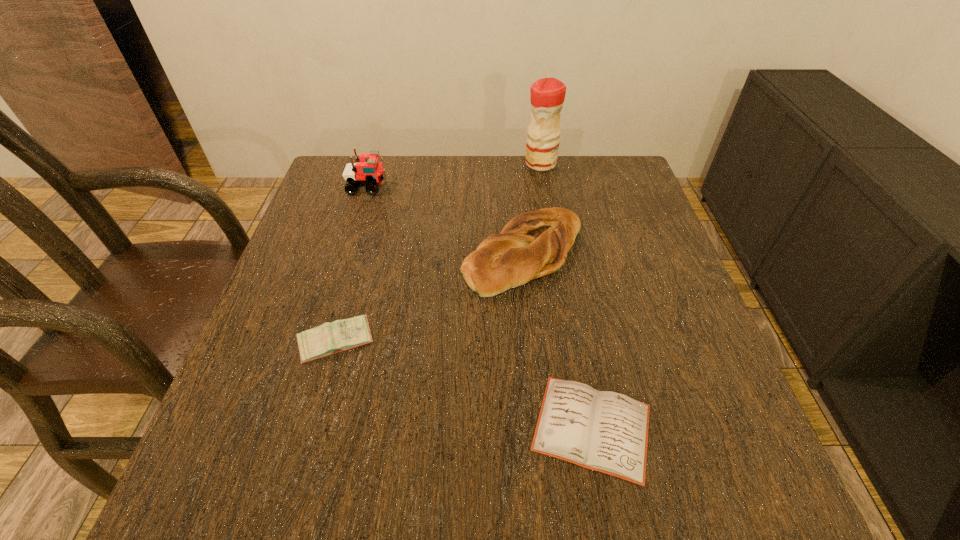
You are a GUI agent. You are given a task and a screenshot of the screen. Output one action in this format:
    pyautogui.click(x=<x>, y=<y>)
    Task: Click on the object positioned at the right edge
    The image size is (960, 540).
    Given the screenshot: What is the action you would take?
    pyautogui.click(x=604, y=431)

In order to click on object that is at the far left corner in this screenshot , I will do (x=368, y=172).

Where is `object at the near right corner`? This screenshot has height=540, width=960. object at the near right corner is located at coordinates (604, 431).

You are a GUI agent. You are given a task and a screenshot of the screen. Output one action in this format:
    pyautogui.click(x=<x>, y=<y>)
    Task: Click on the vacant space at the far edge
    The height and width of the screenshot is (540, 960).
    Given the screenshot: What is the action you would take?
    pyautogui.click(x=452, y=174)

The image size is (960, 540). What are the coordinates of `free region at the near edge` in the screenshot? It's located at (377, 490).

Find the location of `vacant space at the left edge of the desktop`. vacant space at the left edge of the desktop is located at coordinates pyautogui.click(x=355, y=279).

You are a GUI agent. You are given a task and a screenshot of the screen. Output one action in this format:
    pyautogui.click(x=<x>, y=<y>)
    Task: Click on the vacant area at the right edge
    The width and height of the screenshot is (960, 540).
    Given the screenshot: What is the action you would take?
    pyautogui.click(x=755, y=447)

Find the location of a particular element. vacant space at the far left corner of the desktop is located at coordinates (338, 172).

Where is `vacant area at the near left corner of the desktop`? The width and height of the screenshot is (960, 540). vacant area at the near left corner of the desktop is located at coordinates (272, 501).

In the image, there is a desktop. Identify the location of vacant space at the far right corner. (615, 204).